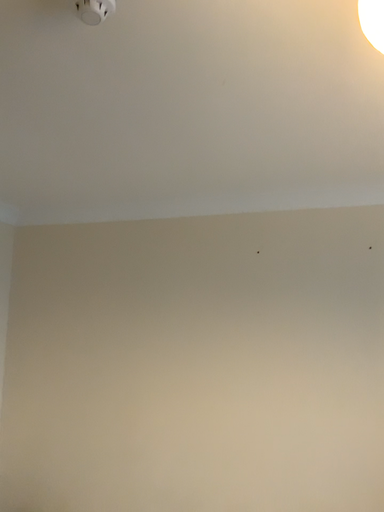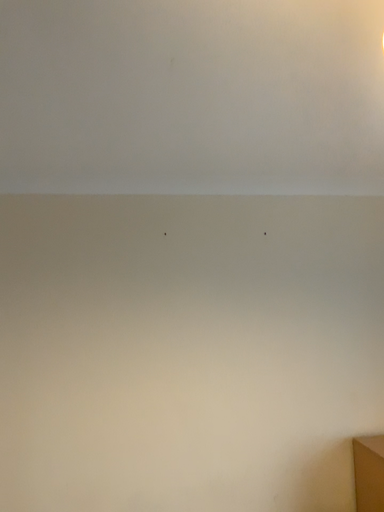
Question: How did the camera likely rotate when shooting the video?

Choices:
 (A) rotated right
 (B) rotated left

Answer: (A)